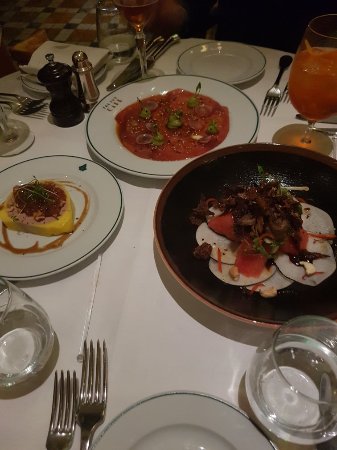
Find the location of a particular element. This screenshot has height=450, width=337. salt shaker is located at coordinates (86, 79).